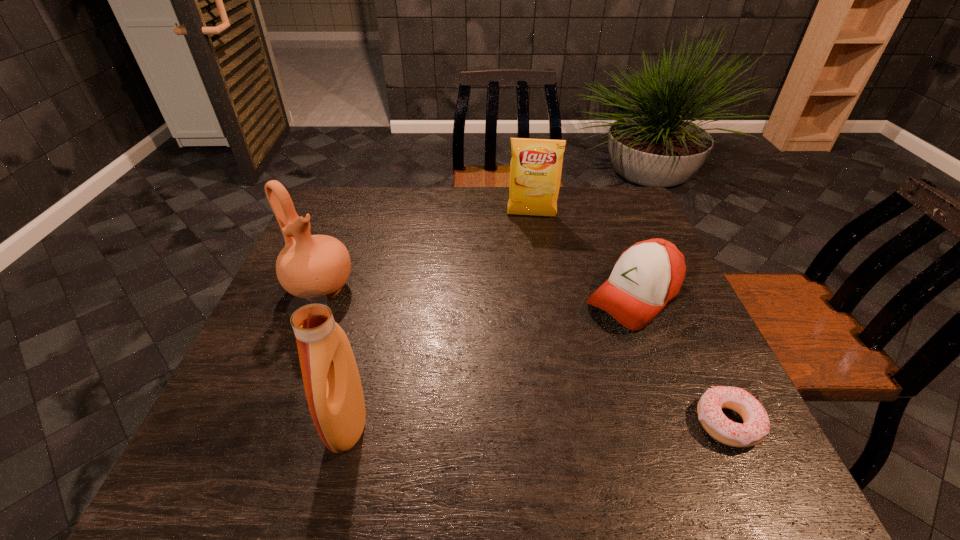
The height and width of the screenshot is (540, 960). Identify the location of vacant position located 0.280m on the front of the crisp (potato chip) with the logo. (528, 282).

You are a GUI agent. You are given a task and a screenshot of the screen. Output one action in this format:
    pyautogui.click(x=<x>, y=<y>)
    Task: Click on the vacant area located on the front of the crisp (potato chip) with the logo
    The width and height of the screenshot is (960, 540).
    Given the screenshot: What is the action you would take?
    tap(528, 274)

Identify the location of vacant area situated 0.050m on the front of the crisp (potato chip) with the logo. The height and width of the screenshot is (540, 960). (530, 231).

Locate an element on the screen. This screenshot has height=540, width=960. free spot located on the spout of the pottery is located at coordinates (369, 327).

The width and height of the screenshot is (960, 540). I want to click on vacant point located on the spout of the pottery, so click(360, 320).

Where is `vacant space located 0.320m on the spout of the pottery`? The width and height of the screenshot is (960, 540). vacant space located 0.320m on the spout of the pottery is located at coordinates (430, 377).

At what (x,y) coordinates should I click in order to perform the action: click on free spot located on the front-facing side of the second shortest object. Please return your answer as a coordinate pair (x, y). This screenshot has height=540, width=960. Looking at the image, I should click on (586, 338).

What are the coordinates of `vacant space situated on the front-facing side of the second shortest object` in the screenshot? It's located at [x=490, y=418].

Where is `vacant region located on the front-facing side of the second shortest object`? This screenshot has height=540, width=960. vacant region located on the front-facing side of the second shortest object is located at coordinates (521, 391).

This screenshot has height=540, width=960. In order to click on object that is at the far edge in this screenshot , I will do [536, 165].